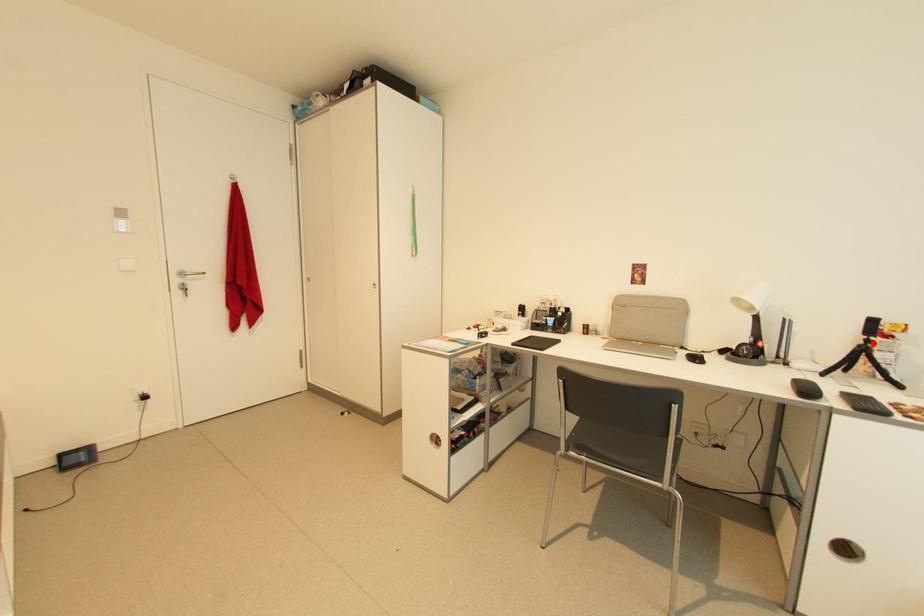
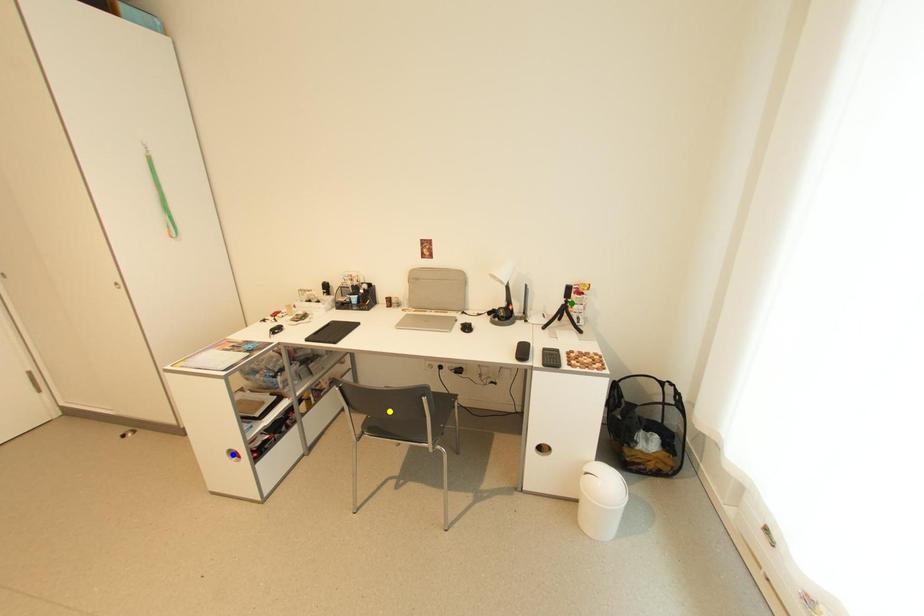
Question: I am providing you with two images of the same scene from different viewpoints. A red point is marked on the first image. You are given multiple points on the second image. Which point in image 2 represents the same 3d spot as the red point in image 1?

Choices:
 (A) green point
 (B) yellow point
 (C) blue point

Answer: (A)